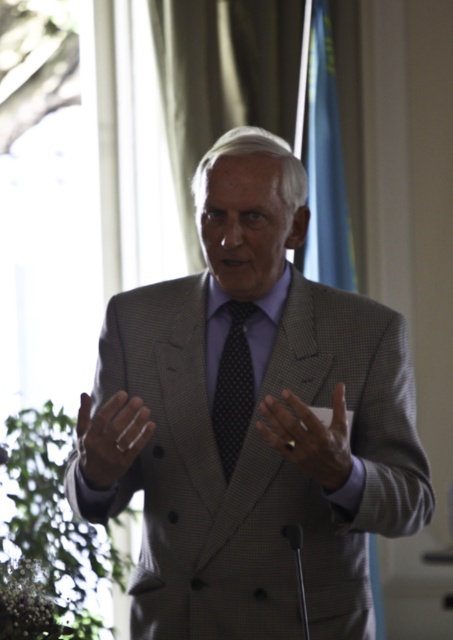
You are a fashion designer observing a man wearing a gray textured suit at center and a clear plastic ring at center. Which item of clothing or accessory is taller?

The gray textured suit at center is much taller than the clear plastic ring at center.

Consider the image. You are a tailor who needs to adjust the clear plastic ring at center so it aligns with the gray textured suit at center. Given that the minimum adjustment you can make is 1 inch, what is the smallest number of adjustments needed to bring them closer?

The distance between the gray textured suit at center and the clear plastic ring at center is 11.43 inches. Since each adjustment can move the ring by at least 1 inch, you would need at least 12 adjustments to cover the distance.

You are a fashion designer observing the image. You need to determine the spatial relationship between the smooth gray suit at center and the clear plastic ring at center. Which object is positioned lower in the image?

The smooth gray suit at center is located below clear plastic ring at center, so the smooth gray suit at center is positioned lower in the image.